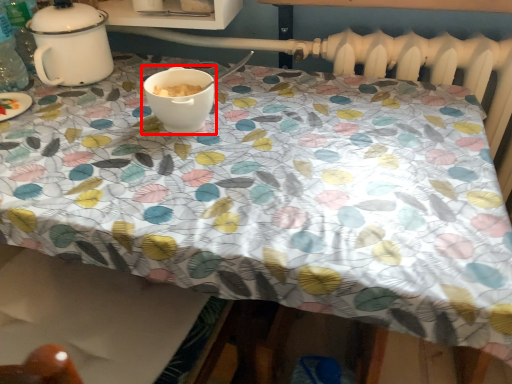
Question: From the image's perspective, where is coffee cup (annotated by the red box) located relative to tableware?

Choices:
 (A) below
 (B) above

Answer: (A)